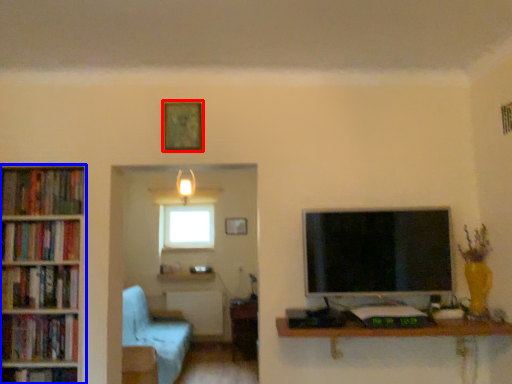
Question: Which object appears closest to the camera in this image, picture frame (highlighted by a red box) or bookcase (highlighted by a blue box)?

Choices:
 (A) picture frame
 (B) bookcase

Answer: (B)